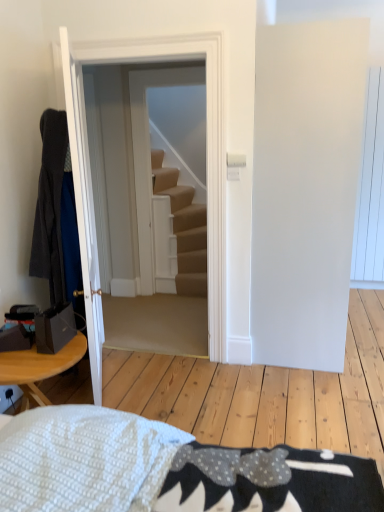
This screenshot has width=384, height=512. In order to click on carpeted stairs at center in this screenshot , I will do `click(184, 228)`.

You are a GUI agent. You are given a task and a screenshot of the screen. Output one action in this format:
    pyautogui.click(x=<x>, y=<y>)
    Task: Click on the dark gray fabric robe at left
    
    Given the screenshot: What is the action you would take?
    pyautogui.click(x=50, y=205)

Measure the distance between point (90, 339) and camera.

The depth of point (90, 339) is 7.89 feet.

Locate an element on the screen. white wooden door at center, the first door viewed from the right is located at coordinates (207, 149).

Does white glossy door at left, the first door positioned from the left, have a lesser height compared to white wooden door at center, the first door viewed from the right?

Yes.

Considering the relative positions of white glossy door at left, the 2th door when ordered from right to left, and white wooden door at center, the first door viewed from the right, in the image provided, is white glossy door at left, the 2th door when ordered from right to left, to the left or to the right of white wooden door at center, the first door viewed from the right,?

white glossy door at left, the 2th door when ordered from right to left, is positioned on white wooden door at center, the first door viewed from the right,'s left side.

Locate an element on the screen. The image size is (384, 512). door on the right of white glossy door at left, the 2th door when ordered from right to left is located at coordinates [x=207, y=149].

Is white glossy door at left, the first door positioned from the left, far from white wooden door at center, which appears as the 2th door when viewed from the left?

No.

From the image's perspective, is white wooden door at center, the first door viewed from the right, above or below dark gray fabric robe at left?

From the image's perspective, white wooden door at center, the first door viewed from the right, appears above dark gray fabric robe at left.

Considering the positions of points (71, 61) and (46, 124), is point (71, 61) farther from camera compared to point (46, 124)?

That is False.

I want to click on robe lying in front of the white wooden door at center, which appears as the 2th door when viewed from the left, so click(50, 205).

Does white wooden door at center, the first door viewed from the right, turn towards dark gray fabric robe at left?

Yes, white wooden door at center, the first door viewed from the right, faces towards dark gray fabric robe at left.

Is white wooden door at center, the first door viewed from the right, at the right side of white glossy door at left, the first door positioned from the left?

Correct, you'll find white wooden door at center, the first door viewed from the right, to the right of white glossy door at left, the first door positioned from the left.

From the image's perspective, which is below, white wooden door at center, which appears as the 2th door when viewed from the left, or white glossy door at left, the first door positioned from the left?

white glossy door at left, the first door positioned from the left, appears lower in the image.

Is point (213, 215) more distant than point (71, 48)?

Yes.

Is white wooden door at center, which appears as the 2th door when viewed from the left, inside the boundaries of white glossy door at left, the first door positioned from the left, or outside?

white wooden door at center, which appears as the 2th door when viewed from the left, is spatially situated outside white glossy door at left, the first door positioned from the left.

Where is `robe below the white wooden door at center, the first door viewed from the right (from the image's perspective)`? This screenshot has height=512, width=384. robe below the white wooden door at center, the first door viewed from the right (from the image's perspective) is located at coordinates (50, 205).

Could you measure the distance between dark gray fabric robe at left and white wooden door at center, the first door viewed from the right?

90.76 centimeters.

Can you confirm if dark gray fabric robe at left is thinner than white wooden door at center, the first door viewed from the right?

No, dark gray fabric robe at left is not thinner than white wooden door at center, the first door viewed from the right.

Considering the sizes of objects dark gray fabric robe at left and white wooden door at center, the first door viewed from the right, in the image provided, who is taller, dark gray fabric robe at left or white wooden door at center, the first door viewed from the right,?

white wooden door at center, the first door viewed from the right, is taller.

I want to click on stairs located above the white wooden door at center, the first door viewed from the right (from the image's perspective), so click(184, 228).

Is white wooden door at center, which appears as the 2th door when viewed from the left, touching carpeted stairs at center?

white wooden door at center, which appears as the 2th door when viewed from the left, is not next to carpeted stairs at center, and they're not touching.

Relative to carpeted stairs at center, is white wooden door at center, which appears as the 2th door when viewed from the left, in front or behind?

Visually, white wooden door at center, which appears as the 2th door when viewed from the left, is located in front of carpeted stairs at center.

Between carpeted stairs at center and dark gray fabric robe at left, which one has smaller size?

Smaller between the two is dark gray fabric robe at left.

I want to click on robe on the left of carpeted stairs at center, so click(x=50, y=205).

Based on the photo, is carpeted stairs at center in front of or behind dark gray fabric robe at left in the image?

In the image, carpeted stairs at center appears behind dark gray fabric robe at left.

Between carpeted stairs at center and dark gray fabric robe at left, which one has more height?

carpeted stairs at center is taller.

How different are the orientations of dark gray fabric robe at left and carpeted stairs at center in degrees?

The angular difference between dark gray fabric robe at left and carpeted stairs at center is 114 degrees.

Between dark gray fabric robe at left and carpeted stairs at center, which one has less height?

dark gray fabric robe at left.

Between dark gray fabric robe at left and carpeted stairs at center, which one has larger size?

carpeted stairs at center is bigger.

The width and height of the screenshot is (384, 512). What are the coordinates of `door behind the white glossy door at left, the first door positioned from the left` in the screenshot? It's located at (207, 149).

Where is `the 1st door located beneath the dark gray fabric robe at left (from a real-world perspective)`? the 1st door located beneath the dark gray fabric robe at left (from a real-world perspective) is located at coordinates (207, 149).

Looking at the image, which one is located closer to white glossy door at left, the first door positioned from the left, carpeted stairs at center or white wooden door at center, which appears as the 2th door when viewed from the left?

white wooden door at center, which appears as the 2th door when viewed from the left.

Looking at the image, which one is located further to dark gray fabric robe at left, white wooden door at center, which appears as the 2th door when viewed from the left, or white glossy door at left, the first door positioned from the left?

white wooden door at center, which appears as the 2th door when viewed from the left.

From the image, which object appears to be nearer to white wooden door at center, which appears as the 2th door when viewed from the left, white glossy door at left, the first door positioned from the left, or carpeted stairs at center?

white glossy door at left, the first door positioned from the left, is positioned closer to the anchor white wooden door at center, which appears as the 2th door when viewed from the left.

Estimate the real-world distances between objects in this image. Which object is further from dark gray fabric robe at left, carpeted stairs at center or white glossy door at left, the first door positioned from the left?

Among the two, carpeted stairs at center is located further to dark gray fabric robe at left.

Which object lies further to the anchor point white wooden door at center, which appears as the 2th door when viewed from the left, white glossy door at left, the 2th door when ordered from right to left, or dark gray fabric robe at left?

dark gray fabric robe at left lies further to white wooden door at center, which appears as the 2th door when viewed from the left, than the other object.

From the image, which object appears to be farther from carpeted stairs at center, white glossy door at left, the 2th door when ordered from right to left, or dark gray fabric robe at left?

Based on the image, white glossy door at left, the 2th door when ordered from right to left, appears to be further to carpeted stairs at center.

Considering their positions, is dark gray fabric robe at left positioned further to white glossy door at left, the 2th door when ordered from right to left, than white wooden door at center, which appears as the 2th door when viewed from the left?

white wooden door at center, which appears as the 2th door when viewed from the left.

Considering their positions, is dark gray fabric robe at left positioned further to white wooden door at center, which appears as the 2th door when viewed from the left, than carpeted stairs at center?

Among the two, carpeted stairs at center is located further to white wooden door at center, which appears as the 2th door when viewed from the left.

Where is `robe positioned between white glossy door at left, the first door positioned from the left, and white wooden door at center, the first door viewed from the right, from near to far`? robe positioned between white glossy door at left, the first door positioned from the left, and white wooden door at center, the first door viewed from the right, from near to far is located at coordinates (50, 205).

I want to click on robe located between white glossy door at left, the first door positioned from the left, and carpeted stairs at center in the depth direction, so click(50, 205).

This screenshot has width=384, height=512. Identify the location of door located between dark gray fabric robe at left and carpeted stairs at center in the depth direction. (207, 149).

Where is `door between white glossy door at left, the first door positioned from the left, and carpeted stairs at center from front to back`? This screenshot has height=512, width=384. door between white glossy door at left, the first door positioned from the left, and carpeted stairs at center from front to back is located at coordinates (207, 149).